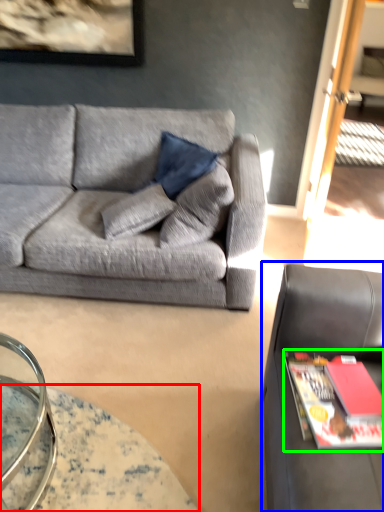
Question: Considering the real-world distances, which object is closest to table (highlighted by a red box)? studio couch (highlighted by a blue box) or magazine (highlighted by a green box).

Choices:
 (A) studio couch
 (B) magazine

Answer: (A)